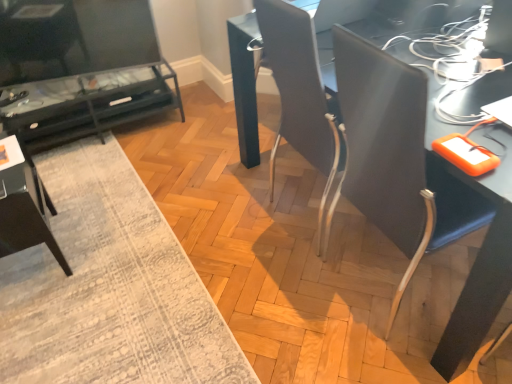
Where is `vacant area that is in front of matte black table at center, the 1th table from the right`? The width and height of the screenshot is (512, 384). vacant area that is in front of matte black table at center, the 1th table from the right is located at coordinates (298, 293).